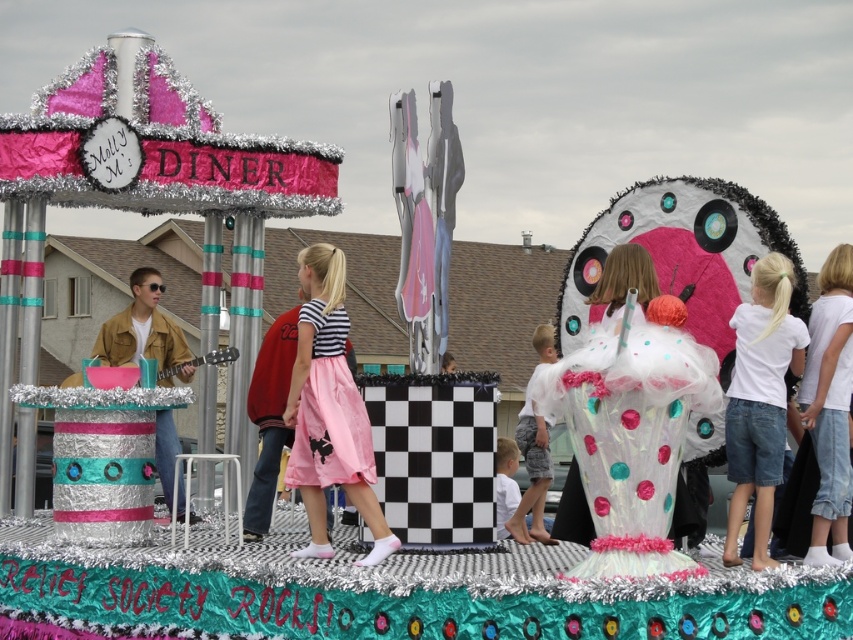
Question: Among these objects, which one is farthest from the camera?

Choices:
 (A) white cotton shirt at right
 (B) white cotton shirt at center
 (C) white denim shorts at lower right
 (D) translucent tulle dress at center

Answer: (B)

Question: Which object is the closest to the white denim shorts at lower right?

Choices:
 (A) white cotton shirt at right
 (B) translucent tulle dress at center
 (C) white cotton shirt at center
 (D) pink satin skirt at center

Answer: (A)

Question: Is white denim shorts at lower right positioned behind translucent tulle dress at center?

Choices:
 (A) yes
 (B) no

Answer: (A)

Question: Is white denim shorts at lower right below white cotton shirt at right?

Choices:
 (A) no
 (B) yes

Answer: (B)

Question: Which of the following is the closest to the observer?

Choices:
 (A) (321, 339)
 (B) (555, 360)
 (C) (807, 369)
 (D) (769, 481)

Answer: (D)

Question: Is pink satin skirt at center to the left of white denim shorts at lower right from the viewer's perspective?

Choices:
 (A) yes
 (B) no

Answer: (A)